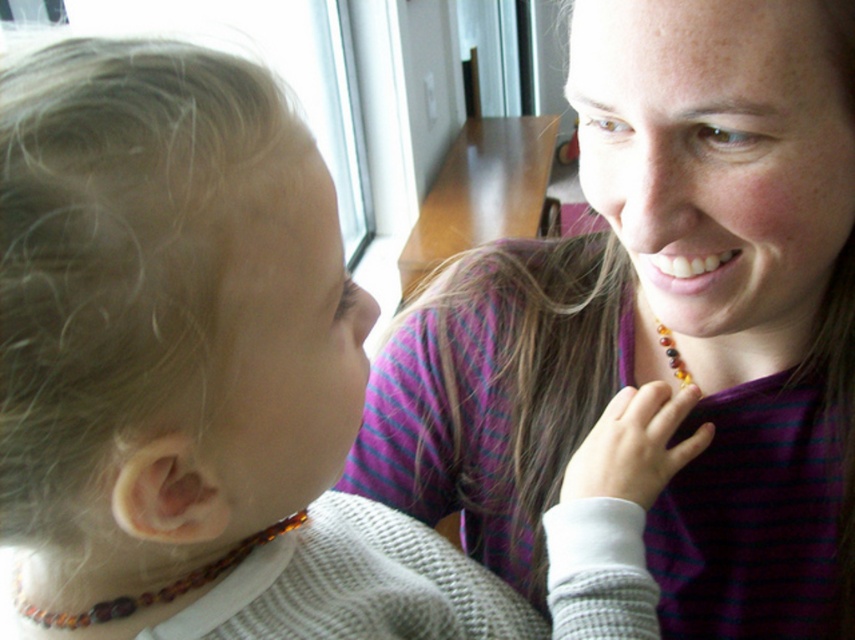
Question: Which of the following is the farthest from the observer?

Choices:
 (A) cognac amber beads at left
 (B) amber beaded necklace at left

Answer: (A)

Question: Is matte amber necklace at center above amber beaded necklace at left?

Choices:
 (A) no
 (B) yes

Answer: (B)

Question: Does cognac amber beads at left have a larger size compared to amber beaded necklace at center?

Choices:
 (A) yes
 (B) no

Answer: (A)

Question: Which point is closer to the camera?

Choices:
 (A) cognac amber beads at left
 (B) amber beaded necklace at center
 (C) amber beaded necklace at left
 (D) matte amber necklace at center

Answer: (C)

Question: Is amber beaded necklace at left further to camera compared to amber beaded necklace at center?

Choices:
 (A) yes
 (B) no

Answer: (B)

Question: Estimate the real-world distances between objects in this image. Which object is closer to the amber beaded necklace at center?

Choices:
 (A) cognac amber beads at left
 (B) amber beaded necklace at left

Answer: (A)